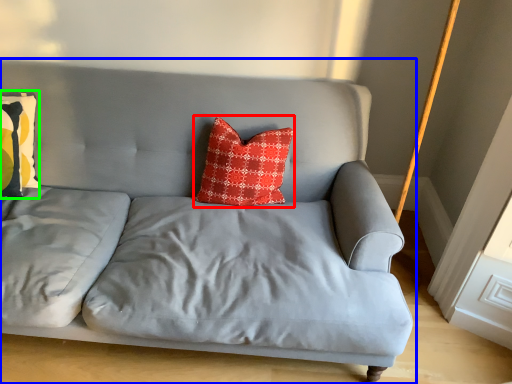
Question: Estimate the real-world distances between objects in this image. Which object is closer to pillow (highlighted by a red box), studio couch (highlighted by a blue box) or pillow (highlighted by a green box)?

Choices:
 (A) studio couch
 (B) pillow

Answer: (A)